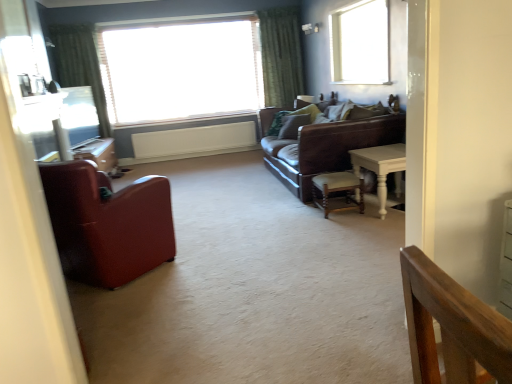
Identify the location of free space to the left of white wooden table at right. The height and width of the screenshot is (384, 512). (331, 223).